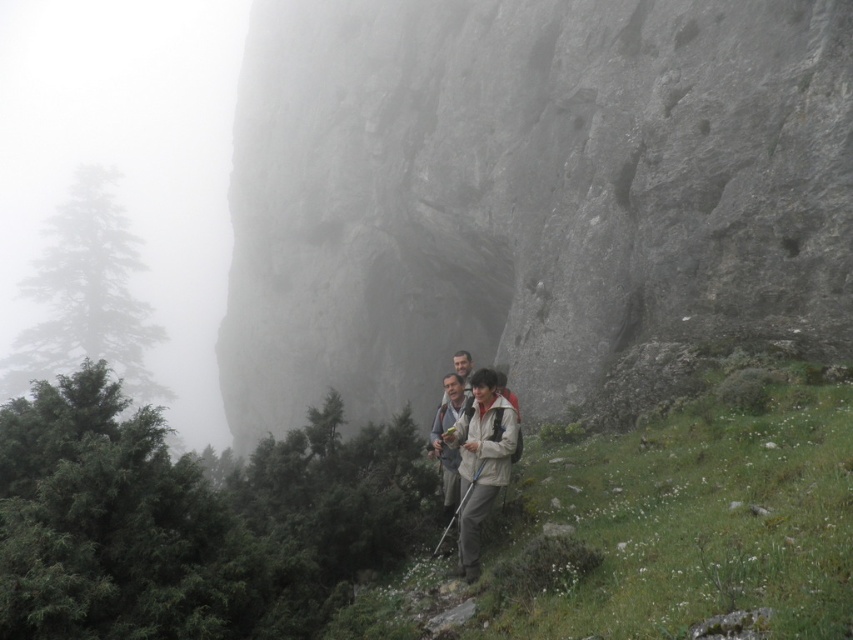
Measure the distance between rugged stone mountain at center and beige fabric jacket at center.

26.53 meters

Is rugged stone mountain at center below beige fabric jacket at center?

No, rugged stone mountain at center is not below beige fabric jacket at center.

Between point (846, 237) and point (506, 433), which one is positioned behind?

The point (846, 237) is behind.

Locate an element on the screen. The height and width of the screenshot is (640, 853). rugged stone mountain at center is located at coordinates (525, 192).